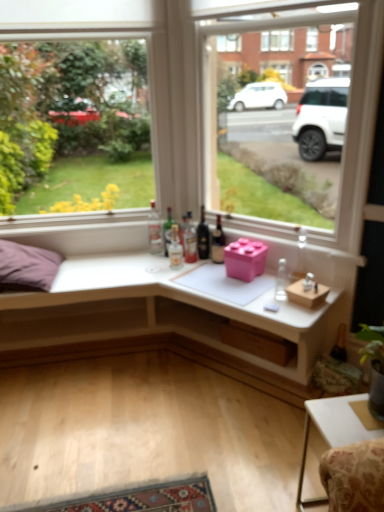
Locate an element on the screen. vacant region in front of wooden at lower center, the first window box positioned from the bottom is located at coordinates (273, 372).